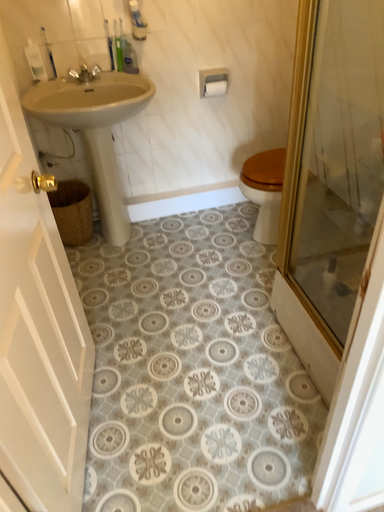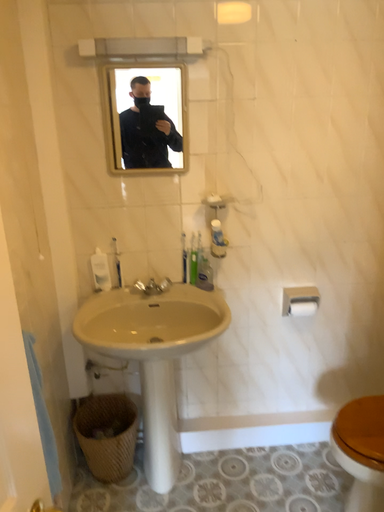
Question: How did the camera likely rotate when shooting the video?

Choices:
 (A) rotated upward
 (B) rotated downward

Answer: (A)